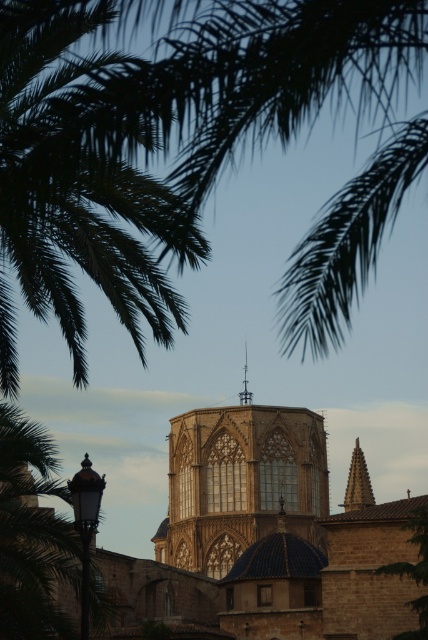
You are an architect designing a new garden that needs to fit between the green leafy palm at upper left and the golden stone spire at center. What should you consider regarding their widths?

The green leafy palm at upper left might be wider than the golden stone spire at center, so you should plan the garden layout to accommodate the palm tree first to ensure there is enough space.

You are a tourist standing in front of the historic stone building. You notice the green leafy tree at lower right and the golden stone spire at center. Which object is closer to you?

The green leafy tree at lower right is closer to you because it is in front of the golden stone spire at center.